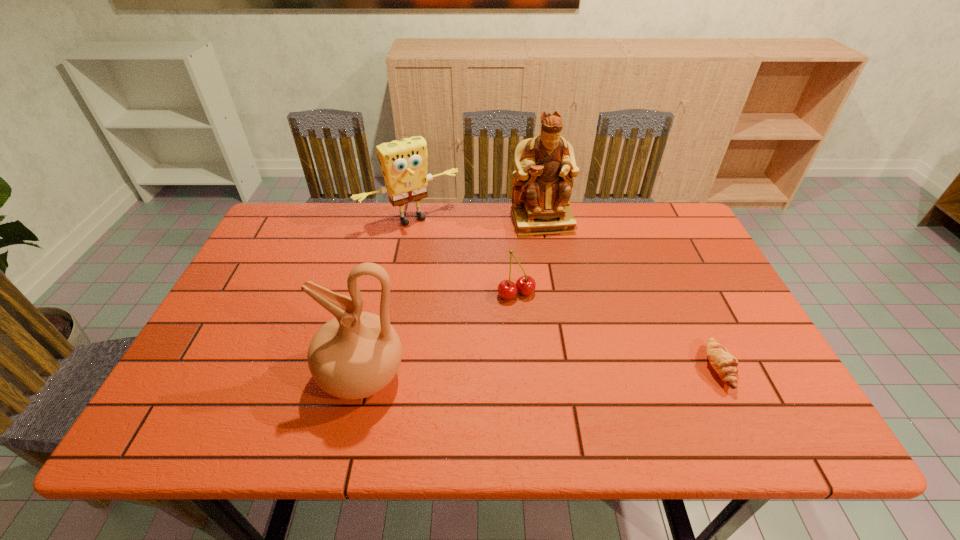
Where is `vacant space on the desktop that is between the pottery and the shortest object and is positioned with the stems of the cherry pointing upwards`? The width and height of the screenshot is (960, 540). vacant space on the desktop that is between the pottery and the shortest object and is positioned with the stems of the cherry pointing upwards is located at coordinates (563, 372).

This screenshot has width=960, height=540. Find the location of `vacant spot on the desktop that is between the pottery and the pastry and is positioned on the face of the sponge`. vacant spot on the desktop that is between the pottery and the pastry and is positioned on the face of the sponge is located at coordinates [525, 373].

The height and width of the screenshot is (540, 960). I want to click on vacant space on the desktop that is between the pottery and the shortest object and is positioned on the front-facing side of the figurine, so click(x=587, y=371).